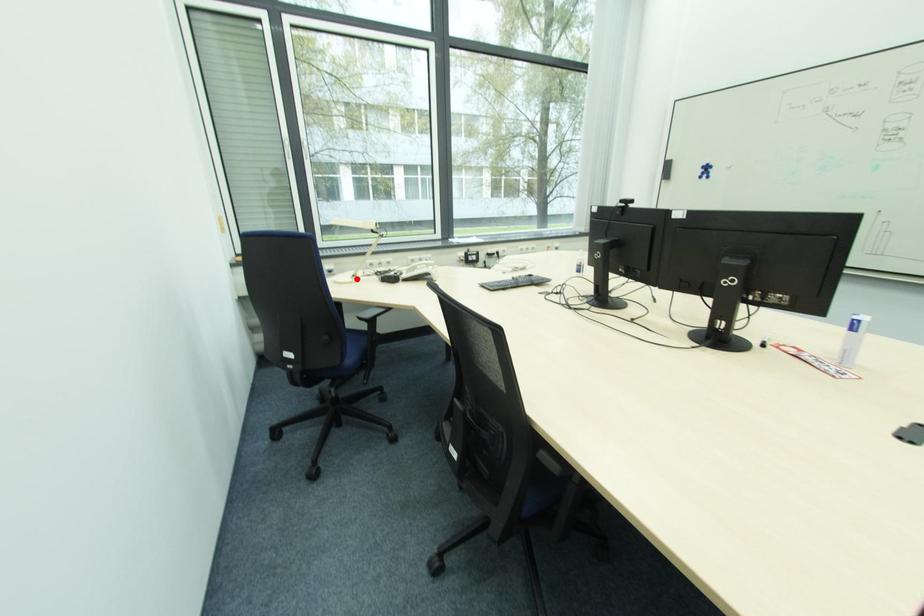
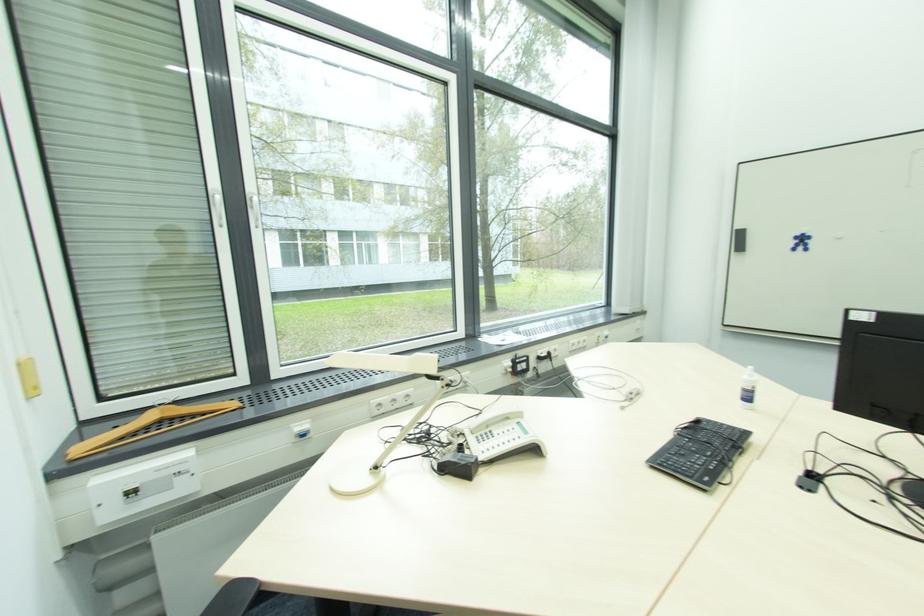
The point at the highlighted location is marked in the first image. Where is the corresponding point in the second image?

(380, 469)